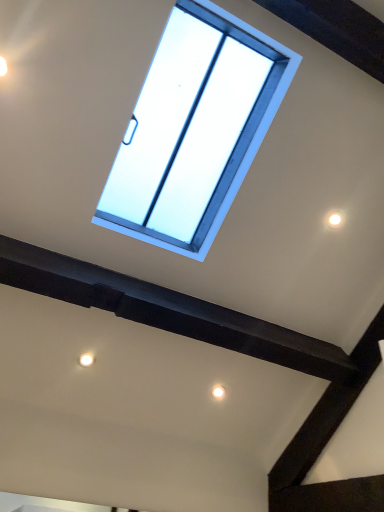
In order to click on transparent glass window at center in this screenshot , I will do `click(194, 129)`.

What is the approximate width of transparent glass window at center?

The width of transparent glass window at center is 1.00 meters.

Describe the element at coordinates (194, 129) in the screenshot. I see `transparent glass window at center` at that location.

This screenshot has height=512, width=384. Identify the location of transparent glass window at center. (194, 129).